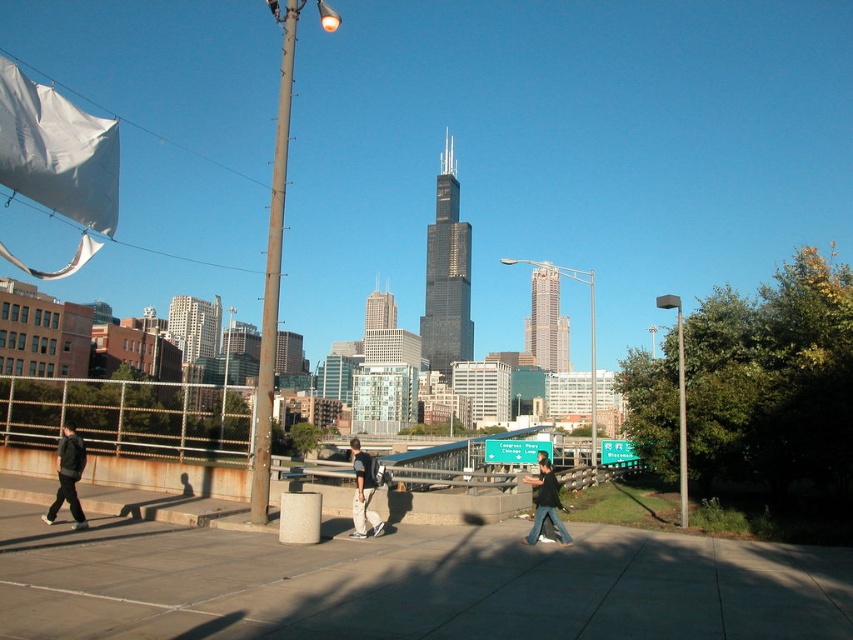
Looking at this image, you are standing on the sidewalk and see the black glass skyscraper at center and the dark gray jeans at center. Which object is closer to you?

The dark gray jeans at center is behind the black glass skyscraper at center, so the black glass skyscraper at center is closer to you.

You are a city planner assessing the urban layout. Given the distance between the black glass skyscraper at center and the dark gray jeans at center, would you consider this distance appropriate for ensuring pedestrian safety and comfort in the area?

The distance between the black glass skyscraper at center and the dark gray jeans at center is 1187.42 feet, which is quite substantial. This large distance likely ensures adequate pedestrian safety and comfort as there is ample space between the skyscraper and the pedestrian area where the dark gray jeans at center is located.